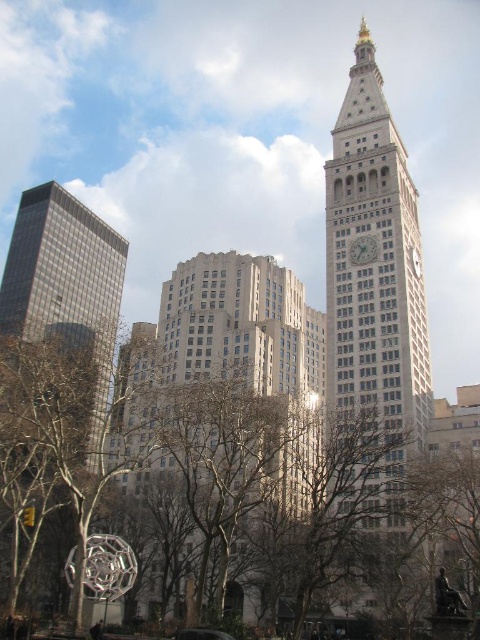
Question: Which point is farther to the camera?

Choices:
 (A) (403, 342)
 (B) (363, 248)

Answer: (B)

Question: Is brown leafless tree at center below white stone clock at center?

Choices:
 (A) no
 (B) yes

Answer: (B)

Question: Which point appears closest to the camera in this image?

Choices:
 (A) (274, 538)
 (B) (199, 637)
 (C) (372, 243)
 (D) (371, 333)

Answer: (B)

Question: Which object appears farthest from the camera in this image?

Choices:
 (A) metallic green car at center
 (B) brown leafless tree at center
 (C) brown leafless tree at lower left
 (D) gold-plated stone clock tower at center

Answer: (D)

Question: Does brown leafless tree at center have a lesser width compared to metallic green car at center?

Choices:
 (A) no
 (B) yes

Answer: (A)

Question: Is brown leafless tree at lower left closer to the viewer compared to white stone clock at center?

Choices:
 (A) no
 (B) yes

Answer: (B)